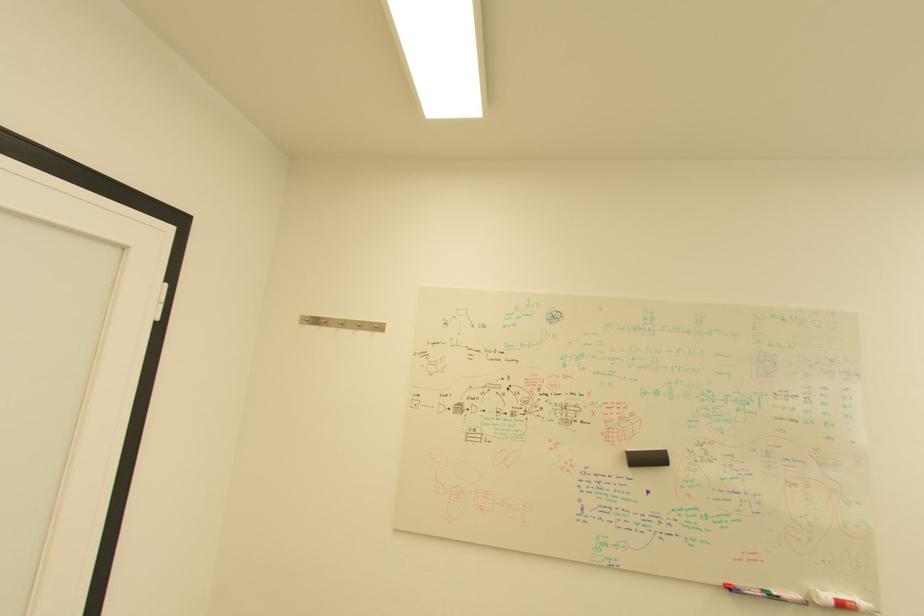
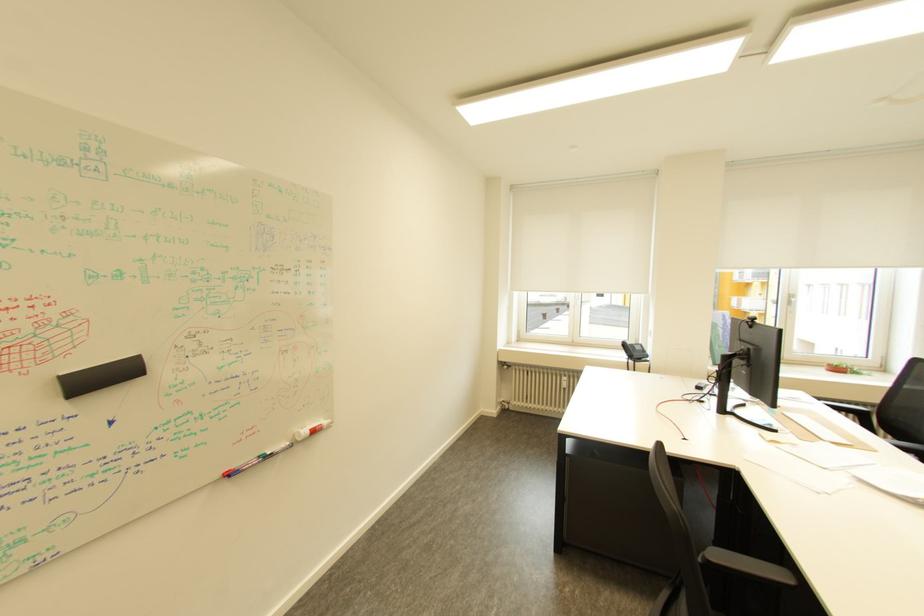
Question: The camera is either moving clockwise (left) or counter-clockwise (right) around the object. The first image is from the beginning of the video and the second image is from the end. Is the camera moving left or right when shooting the video?

Choices:
 (A) Left
 (B) Right

Answer: (A)